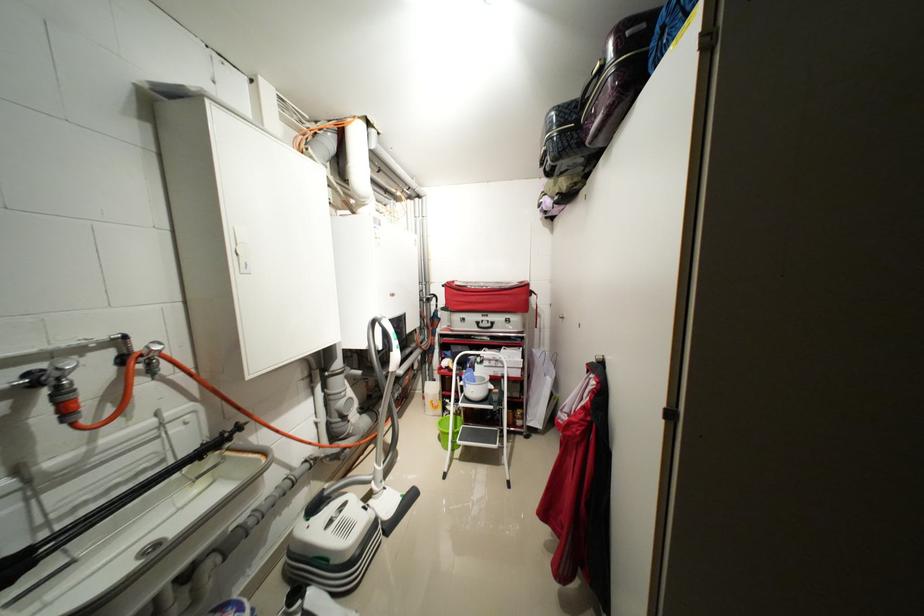
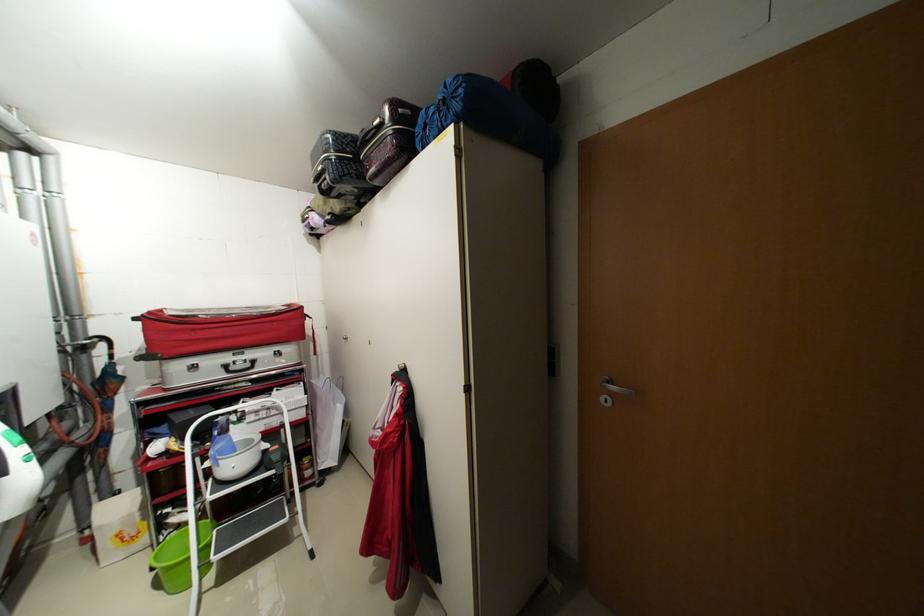
Question: The first image is from the beginning of the video and the second image is from the end. How did the camera likely rotate when shooting the video?

Choices:
 (A) Left
 (B) Right
 (C) Up
 (D) Down

Answer: (B)